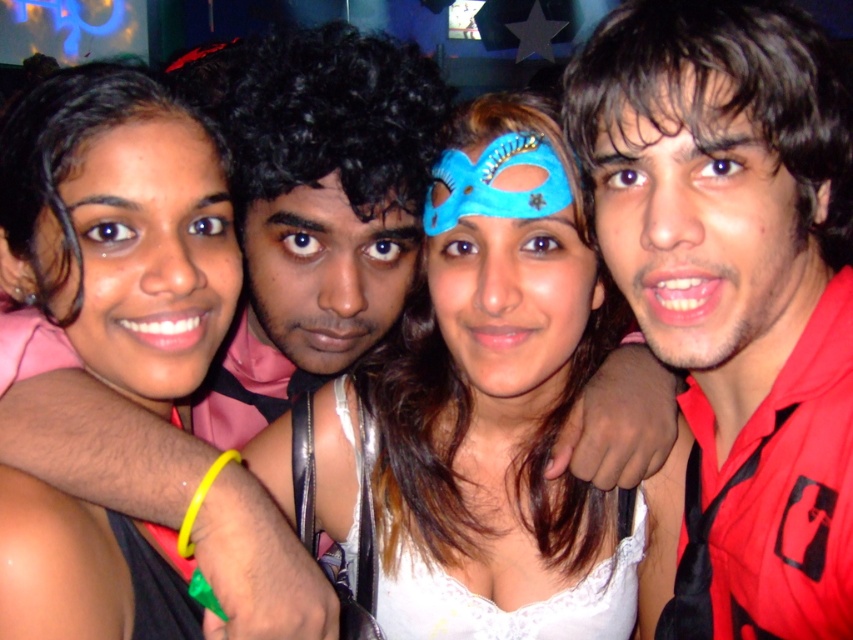
You are a photographer adjusting the lighting for a group photo. You need to ensure that both the matte black dress at center and the blue velvet mask at center are well illuminated. Given their distance apart, can you adjust the lighting to cover both objects adequately?

The matte black dress at center and the blue velvet mask at center are 13.63 inches apart, so yes, the lighting can be adjusted to cover both objects adequately as they are within a reasonable distance for proper illumination.

You are at a party and want to take a photo with the red matte shirt at right and the matte black dress at center. Based on their sizes, which one would appear bigger in the photo?

The red matte shirt at right appears bigger in the photo because it has a larger size compared to the matte black dress at center.